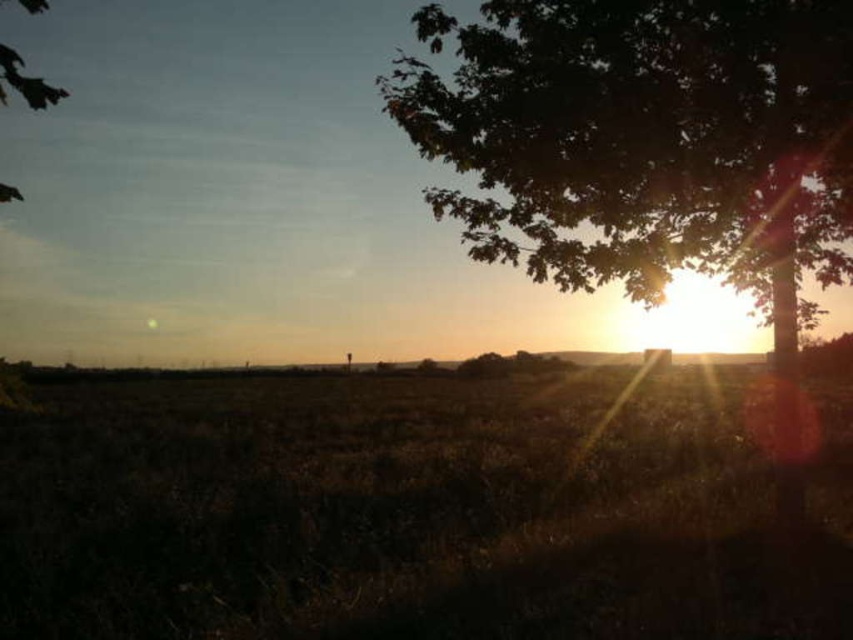
Question: Does green leafy tree at upper right have a lesser width compared to green leafy tree at upper left?

Choices:
 (A) no
 (B) yes

Answer: (B)

Question: Among these points, which one is farthest from the camera?

Choices:
 (A) (35, 106)
 (B) (288, 541)

Answer: (B)

Question: In this image, where is green leafy tree at upper right located relative to green leafy tree at upper left?

Choices:
 (A) above
 (B) below

Answer: (B)

Question: Which point appears farthest from the camera in this image?

Choices:
 (A) (62, 92)
 (B) (641, 92)

Answer: (B)

Question: Can you confirm if green leafy tree at upper right is thinner than green leafy tree at upper left?

Choices:
 (A) yes
 (B) no

Answer: (A)

Question: Which of the following is the closest to the observer?

Choices:
 (A) brown grassy at center
 (B) green leafy tree at upper right

Answer: (A)